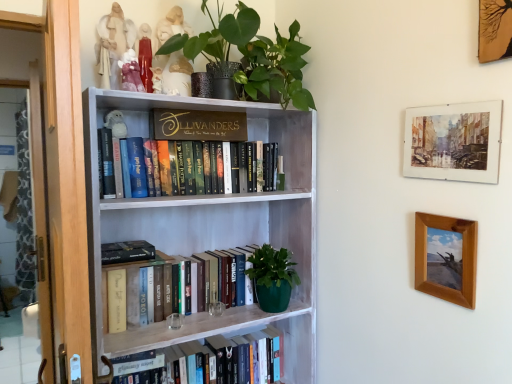
Measure the distance between point (187, 151) and camera.

The distance of point (187, 151) from camera is 5.24 feet.

You are a GUI agent. You are given a task and a screenshot of the screen. Output one action in this format:
    pyautogui.click(x=<x>, y=<y>)
    Task: Click on the hardcover books at upper center, the 2th book positioned from the top
    
    Given the screenshot: What is the action you would take?
    pyautogui.click(x=165, y=166)

The width and height of the screenshot is (512, 384). What do you see at coordinates (251, 55) in the screenshot? I see `green matte plant at upper center` at bounding box center [251, 55].

Identify the location of transparent glass door at left. The image size is (512, 384). (39, 204).

The height and width of the screenshot is (384, 512). What do you see at coordinates (495, 30) in the screenshot? I see `wooden picture frame at upper right, arranged as the 3th picture frame when ordered from the bottom` at bounding box center [495, 30].

What do you see at coordinates (211, 363) in the screenshot? The image size is (512, 384). I see `hardcover book at lower center, which is counted as the first book, starting from the bottom` at bounding box center [211, 363].

This screenshot has height=384, width=512. In order to click on hardcover books at upper center, the 2th book positioned from the top in this screenshot , I will do `click(165, 166)`.

Considering their positions, is porcelain figurine at upper center, marked as the second toy in a bottom-to-top arrangement, located in front of or behind white wood bookcase at center?

In the image, porcelain figurine at upper center, marked as the second toy in a bottom-to-top arrangement, appears behind white wood bookcase at center.

Could you tell me if porcelain figurine at upper center, which appears as the 3th toy when viewed from the top, is turned towards white wood bookcase at center?

No, porcelain figurine at upper center, which appears as the 3th toy when viewed from the top, is not oriented towards white wood bookcase at center.

Locate an element on the screen. This screenshot has height=384, width=512. the 2nd toy above the white wood bookcase at center (from a real-world perspective) is located at coordinates pyautogui.click(x=157, y=79).

Considering the relative sizes of porcelain figurine at upper center, which appears as the 3th toy when viewed from the top, and white wood bookcase at center in the image provided, is porcelain figurine at upper center, which appears as the 3th toy when viewed from the top, taller than white wood bookcase at center?

In fact, porcelain figurine at upper center, which appears as the 3th toy when viewed from the top, may be shorter than white wood bookcase at center.

Is watercolor paper painting at upper right, which appears as the second picture frame when viewed from the top, next to matte porcelain figurine at upper center, which is the third toy from bottom to top?

They are not placed beside each other.

From a real-world perspective, is watercolor paper painting at upper right, which appears as the second picture frame when viewed from the top, physically located above or below matte porcelain figurine at upper center, which is the 2th toy from top to bottom?

Clearly, from a real-world perspective, watercolor paper painting at upper right, which appears as the second picture frame when viewed from the top, is below matte porcelain figurine at upper center, which is the 2th toy from top to bottom.

Between watercolor paper painting at upper right, the second picture frame from the bottom, and matte porcelain figurine at upper center, which is the third toy from bottom to top, which one has smaller size?

matte porcelain figurine at upper center, which is the third toy from bottom to top, is smaller.

In the scene shown: In terms of width, does watercolor paper painting at upper right, which appears as the second picture frame when viewed from the top, look wider or thinner when compared to matte porcelain figurine at upper center, which is the 2th toy from top to bottom?

watercolor paper painting at upper right, which appears as the second picture frame when viewed from the top, is thinner than matte porcelain figurine at upper center, which is the 2th toy from top to bottom.

How distant is hardcover book at center, the 2th book positioned from the bottom, from green matte plant at upper center?

A distance of 32.45 inches exists between hardcover book at center, the 2th book positioned from the bottom, and green matte plant at upper center.

Does hardcover book at center, positioned as the 3th book in top-to-bottom order, turn towards green matte plant at upper center?

No, hardcover book at center, positioned as the 3th book in top-to-bottom order, is not facing towards green matte plant at upper center.

Is there a large distance between hardcover book at center, the 2th book positioned from the bottom, and green matte plant at upper center?

hardcover book at center, the 2th book positioned from the bottom, is actually quite close to green matte plant at upper center.

Can you confirm if hardcover book at center, the 2th book positioned from the bottom, is bigger than green matte plant at upper center?

Actually, hardcover book at center, the 2th book positioned from the bottom, might be smaller than green matte plant at upper center.

Is gold metallic sign at upper center, which is the fourth book from bottom to top, at the back of porcelain figurine at upper center, marked as the second toy in a bottom-to-top arrangement?

No, porcelain figurine at upper center, marked as the second toy in a bottom-to-top arrangement,'s orientation is not away from gold metallic sign at upper center, which is the fourth book from bottom to top.

From a real-world perspective, which is physically above, porcelain figurine at upper center, which appears as the 3th toy when viewed from the top, or gold metallic sign at upper center, which is counted as the first book, starting from the top?

In real-world perspective, porcelain figurine at upper center, which appears as the 3th toy when viewed from the top, is above.

Can you confirm if porcelain figurine at upper center, which appears as the 3th toy when viewed from the top, is smaller than gold metallic sign at upper center, which is counted as the first book, starting from the top?

Indeed, porcelain figurine at upper center, which appears as the 3th toy when viewed from the top, has a smaller size compared to gold metallic sign at upper center, which is counted as the first book, starting from the top.

From the image's perspective, would you say porcelain figurine at upper center, which appears as the 3th toy when viewed from the top, is shown under gold metallic sign at upper center, which is the fourth book from bottom to top?

Incorrect, from the image's perspective, porcelain figurine at upper center, which appears as the 3th toy when viewed from the top, is higher than gold metallic sign at upper center, which is the fourth book from bottom to top.

Which is in front, point (117, 37) or point (476, 267)?

The point (476, 267) is closer to the camera.

Is matte white figurine at upper left, arranged as the fourth toy when ordered from the bottom, wider or thinner than brown wooden picture frame at right, acting as the first picture frame starting from the bottom?

matte white figurine at upper left, arranged as the fourth toy when ordered from the bottom, is wider than brown wooden picture frame at right, acting as the first picture frame starting from the bottom.

From the image's perspective, which is above, matte white figurine at upper left, the 1th toy viewed from the top, or brown wooden picture frame at right, the 3th picture frame viewed from the top?

From the image's view, matte white figurine at upper left, the 1th toy viewed from the top, is above.

Considering the sizes of objects matte white figurine at upper left, arranged as the fourth toy when ordered from the bottom, and brown wooden picture frame at right, acting as the first picture frame starting from the bottom, in the image provided, who is smaller, matte white figurine at upper left, arranged as the fourth toy when ordered from the bottom, or brown wooden picture frame at right, acting as the first picture frame starting from the bottom,?

brown wooden picture frame at right, acting as the first picture frame starting from the bottom, is smaller.

Is brown wooden picture frame at right, acting as the first picture frame starting from the bottom, not within porcelain figurine at upper center, which appears as the 3th toy when viewed from the top?

Yes, brown wooden picture frame at right, acting as the first picture frame starting from the bottom, is not within porcelain figurine at upper center, which appears as the 3th toy when viewed from the top.

Considering the sizes of objects brown wooden picture frame at right, acting as the first picture frame starting from the bottom, and porcelain figurine at upper center, marked as the second toy in a bottom-to-top arrangement, in the image provided, who is taller, brown wooden picture frame at right, acting as the first picture frame starting from the bottom, or porcelain figurine at upper center, marked as the second toy in a bottom-to-top arrangement,?

brown wooden picture frame at right, acting as the first picture frame starting from the bottom, is taller.

Consider the image. Which object is further away from the camera, brown wooden picture frame at right, acting as the first picture frame starting from the bottom, or porcelain figurine at upper center, marked as the second toy in a bottom-to-top arrangement?

porcelain figurine at upper center, marked as the second toy in a bottom-to-top arrangement, is further away from the camera.

Considering the positions of objects brown wooden picture frame at right, acting as the first picture frame starting from the bottom, and porcelain figurine at upper center, marked as the second toy in a bottom-to-top arrangement, in the image provided, who is more to the left, brown wooden picture frame at right, acting as the first picture frame starting from the bottom, or porcelain figurine at upper center, marked as the second toy in a bottom-to-top arrangement,?

Positioned to the left is porcelain figurine at upper center, marked as the second toy in a bottom-to-top arrangement.

From the image's perspective, does white plush owl at upper left, which is counted as the 1th toy, starting from the bottom, appear lower than porcelain figurine at upper center, which appears as the 3th toy when viewed from the top?

Yes, from the image's perspective, white plush owl at upper left, which is counted as the 1th toy, starting from the bottom, is beneath porcelain figurine at upper center, which appears as the 3th toy when viewed from the top.

In terms of size, does white plush owl at upper left, the 4th toy when ordered from top to bottom, appear bigger or smaller than porcelain figurine at upper center, marked as the second toy in a bottom-to-top arrangement?

In the image, white plush owl at upper left, the 4th toy when ordered from top to bottom, appears to be larger than porcelain figurine at upper center, marked as the second toy in a bottom-to-top arrangement.

Is white plush owl at upper left, the 4th toy when ordered from top to bottom, shorter than porcelain figurine at upper center, which appears as the 3th toy when viewed from the top?

No, white plush owl at upper left, the 4th toy when ordered from top to bottom, is not shorter than porcelain figurine at upper center, which appears as the 3th toy when viewed from the top.

Where is `the 3rd toy to the left of the porcelain figurine at upper center, marked as the second toy in a bottom-to-top arrangement, starting your count from the anchor`? the 3rd toy to the left of the porcelain figurine at upper center, marked as the second toy in a bottom-to-top arrangement, starting your count from the anchor is located at coordinates (116, 124).

Identify the location of bookcase on the right side of porcelain figurine at upper center, which appears as the 3th toy when viewed from the top. The image size is (512, 384). (206, 240).

Image resolution: width=512 pixels, height=384 pixels. In order to click on toy that is the 2nd one when counting leftward from the watercolor paper painting at upper right, which appears as the second picture frame when viewed from the top in this screenshot , I will do `click(130, 72)`.

When comparing their distances from gold metallic sign at upper center, which is the fourth book from bottom to top, does matte white figurine at upper left, arranged as the fourth toy when ordered from the bottom, or watercolor paper painting at upper right, the second picture frame from the bottom, seem closer?

matte white figurine at upper left, arranged as the fourth toy when ordered from the bottom, is positioned closer to the anchor gold metallic sign at upper center, which is the fourth book from bottom to top.

Based on their spatial positions, is wooden picture frame at upper right, which ranks as the first picture frame in top-to-bottom order, or white wood bookcase at center closer to watercolor paper painting at upper right, the second picture frame from the bottom?

Based on the image, wooden picture frame at upper right, which ranks as the first picture frame in top-to-bottom order, appears to be nearer to watercolor paper painting at upper right, the second picture frame from the bottom.

Which object lies nearer to the anchor point white wood bookcase at center, brown wooden picture frame at right, the 3th picture frame viewed from the top, or hardcover book at lower center, marked as the 4th book in a top-to-bottom arrangement?

hardcover book at lower center, marked as the 4th book in a top-to-bottom arrangement, is positioned closer to the anchor white wood bookcase at center.

Consider the image. When comparing their distances from white plush owl at upper left, the 4th toy when ordered from top to bottom, does watercolor paper painting at upper right, which appears as the second picture frame when viewed from the top, or green matte plant at upper center seem closer?

Based on the image, green matte plant at upper center appears to be nearer to white plush owl at upper left, the 4th toy when ordered from top to bottom.

Looking at the image, which one is located closer to porcelain figurine at upper center, marked as the second toy in a bottom-to-top arrangement, gold metallic sign at upper center, which is the fourth book from bottom to top, or matte white figurine at upper left, arranged as the fourth toy when ordered from the bottom?

Among the two, matte white figurine at upper left, arranged as the fourth toy when ordered from the bottom, is located nearer to porcelain figurine at upper center, marked as the second toy in a bottom-to-top arrangement.

Based on their spatial positions, is matte white figurine at upper left, arranged as the fourth toy when ordered from the bottom, or wooden picture frame at upper right, which ranks as the first picture frame in top-to-bottom order, further from brown wooden picture frame at right, acting as the first picture frame starting from the bottom?

The object further to brown wooden picture frame at right, acting as the first picture frame starting from the bottom, is matte white figurine at upper left, arranged as the fourth toy when ordered from the bottom.

Considering their positions, is wooden picture frame at upper right, arranged as the 3th picture frame when ordered from the bottom, positioned closer to white plush owl at upper left, the 4th toy when ordered from top to bottom, than transparent glass door at left?

transparent glass door at left lies closer to white plush owl at upper left, the 4th toy when ordered from top to bottom, than the other object.

Which object lies nearer to the anchor point transparent glass door at left, porcelain figurine at upper center, which appears as the 3th toy when viewed from the top, or hardcover books at upper center, the 3th book positioned from the bottom?

hardcover books at upper center, the 3th book positioned from the bottom, is closer to transparent glass door at left.

I want to click on book between porcelain figurine at upper center, which appears as the 3th toy when viewed from the top, and hardcover books at upper center, the 2th book positioned from the top, from top to bottom, so tap(199, 125).

Locate an element on the screen. toy between matte porcelain figurine at upper center, which is the third toy from bottom to top, and brown wooden picture frame at right, acting as the first picture frame starting from the bottom is located at coordinates (157, 79).

Where is `toy situated between matte porcelain figurine at upper center, which is the third toy from bottom to top, and gold metallic sign at upper center, which is the fourth book from bottom to top, from left to right`? toy situated between matte porcelain figurine at upper center, which is the third toy from bottom to top, and gold metallic sign at upper center, which is the fourth book from bottom to top, from left to right is located at coordinates (157, 79).

At what (x,y) coordinates should I click in order to perform the action: click on bookcase that lies between matte white figurine at upper left, arranged as the fourth toy when ordered from the bottom, and hardcover book at lower center, marked as the 4th book in a top-to-bottom arrangement, from top to bottom. Please return your answer as a coordinate pair (x, y). Looking at the image, I should click on (206, 240).